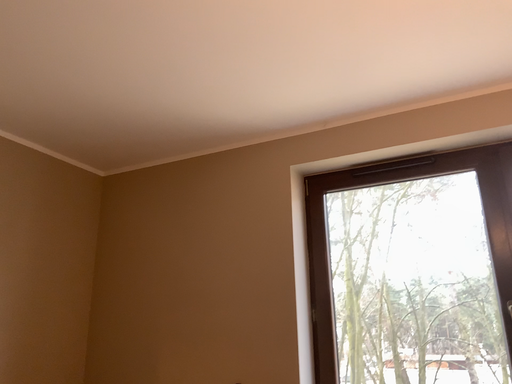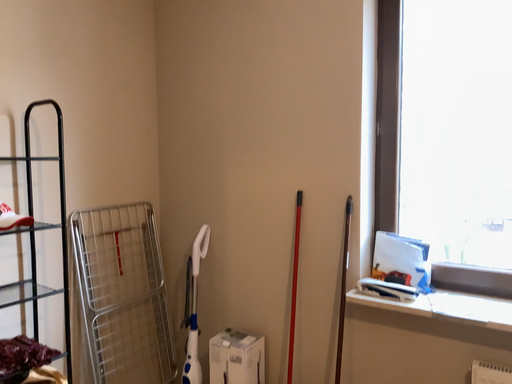
Question: Which way did the camera rotate in the video?

Choices:
 (A) rotated right
 (B) rotated left

Answer: (B)